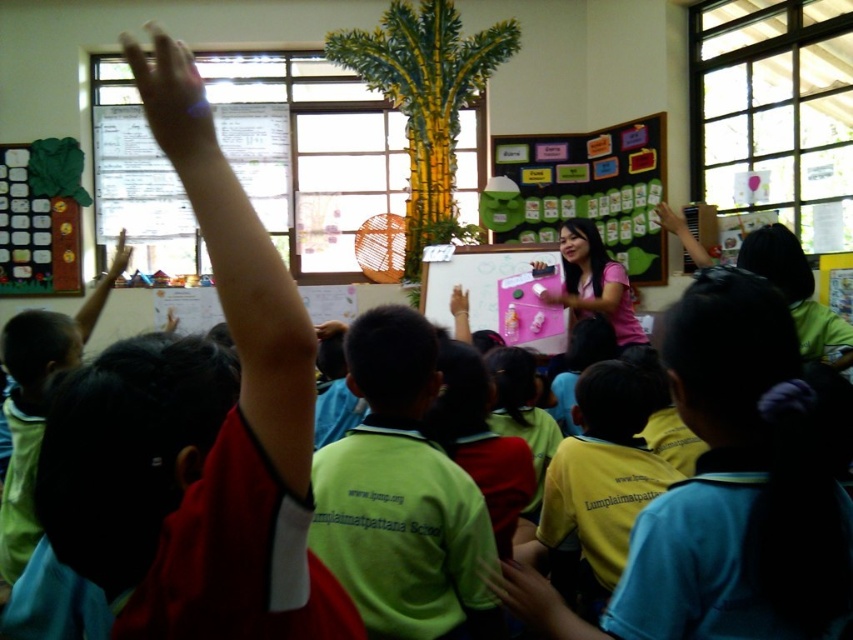
Is point (637, 432) farther from camera compared to point (610, 301)?

No, it is in front of (610, 301).

I want to click on yellow matte shirt at lower center, so coord(601,474).

This screenshot has height=640, width=853. Identify the location of yellow matte shirt at lower center. (601, 474).

Between matte red arm at upper left and smooth skin hand at center, which one has more height?

With more height is matte red arm at upper left.

Is point (148, 77) positioned before point (544, 598)?

Yes, it is.

Identify the location of matte red arm at upper left. This screenshot has height=640, width=853. (236, 260).

Between green felt bulletin board at center and yellow matte shirt at lower center, which one has less height?

yellow matte shirt at lower center

Does green felt bulletin board at center have a larger size compared to yellow matte shirt at lower center?

Correct, green felt bulletin board at center is larger in size than yellow matte shirt at lower center.

Where is `green felt bulletin board at center`? The image size is (853, 640). green felt bulletin board at center is located at coordinates (589, 189).